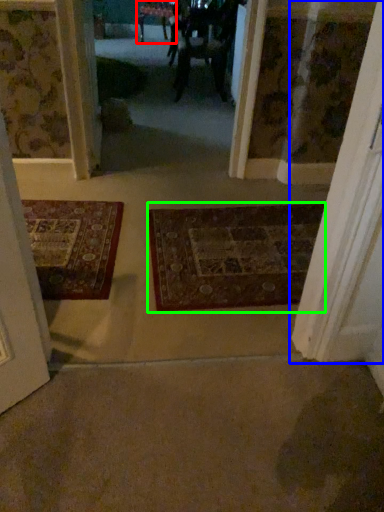
Question: Based on their relative distances, which object is nearer to furniture (highlighted by a red box)? Choose from door (highlighted by a blue box) and mat (highlighted by a green box).

Choices:
 (A) door
 (B) mat

Answer: (B)